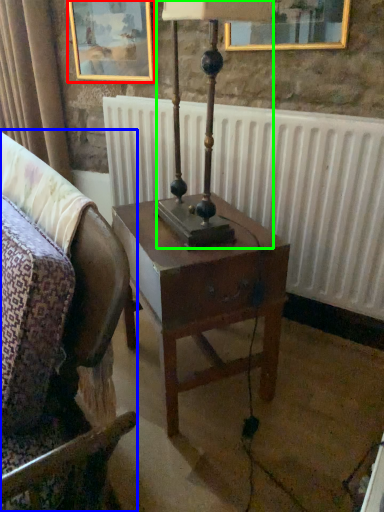
Question: Based on their relative distances, which object is farther from picture frame (highlighted by a red box)? Choose from chair (highlighted by a blue box) and bedside lamp (highlighted by a green box).

Choices:
 (A) chair
 (B) bedside lamp

Answer: (A)